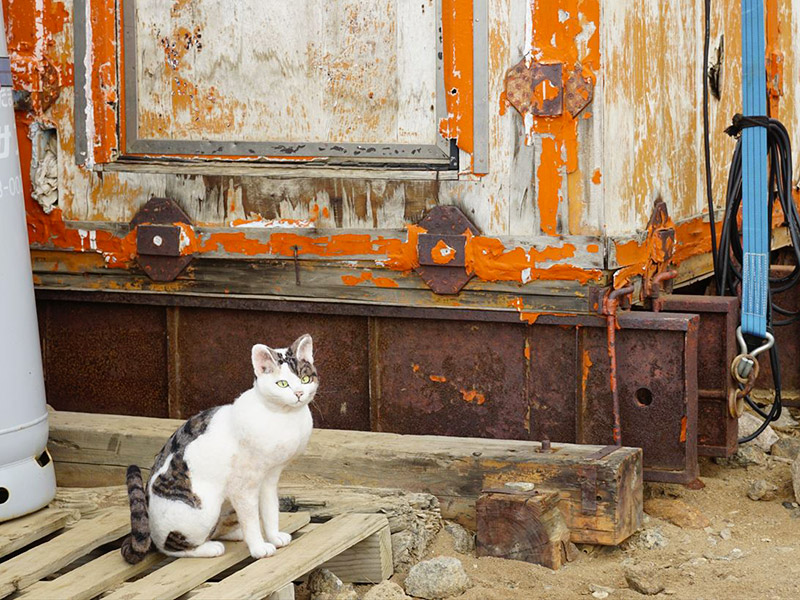
Where is `floor`? This screenshot has width=800, height=600. floor is located at coordinates click(690, 549).